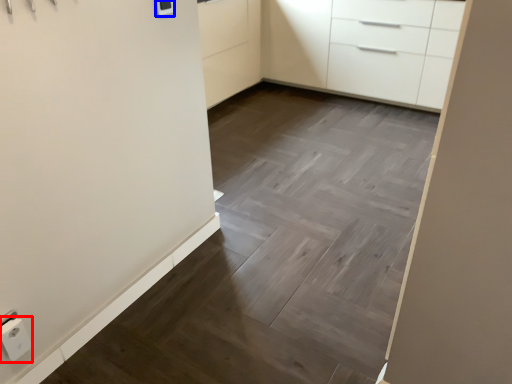
Question: Which object is further to the camera taking this photo, electric outlet (highlighted by a red box) or light switch (highlighted by a blue box)?

Choices:
 (A) electric outlet
 (B) light switch

Answer: (B)